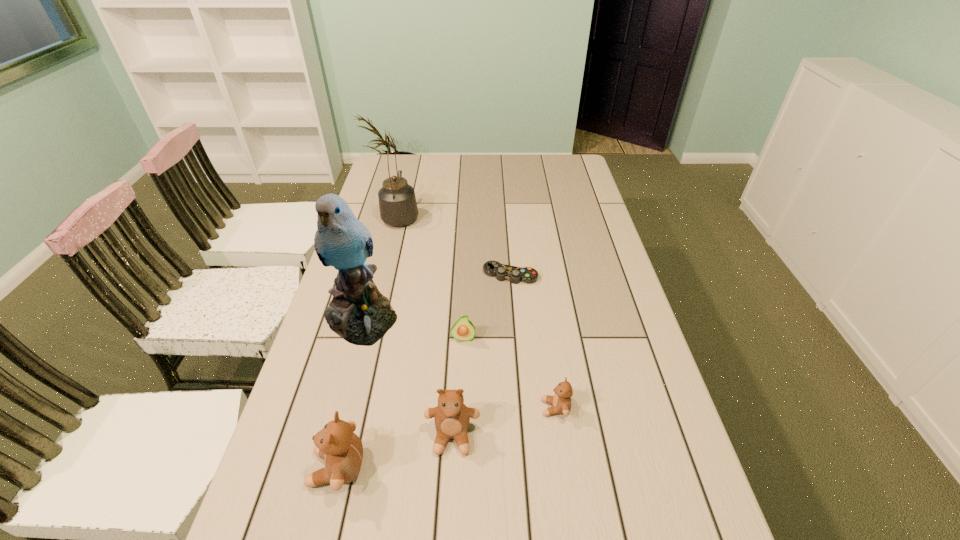
Find the location of a particular element. The image size is (960, 540). vacant space at the far left corner of the desktop is located at coordinates (395, 174).

Locate an element on the screen. This screenshot has width=960, height=540. vacant space at the near left corner of the desktop is located at coordinates (257, 504).

You are a GUI agent. You are given a task and a screenshot of the screen. Output one action in this format:
    pyautogui.click(x=<x>, y=<y>)
    Task: Click on the vacant region between the tallest object and the sixth shortest object
    This screenshot has width=960, height=540.
    Given the screenshot: What is the action you would take?
    pyautogui.click(x=381, y=266)

Find the location of `vacant area that lies between the avocado and the rightmost teddy bear`. vacant area that lies between the avocado and the rightmost teddy bear is located at coordinates (510, 373).

At what (x,y) coordinates should I click in order to perform the action: click on vacant area that lies between the rightmost teddy bear and the parakeet. Please return your answer as a coordinate pair (x, y). Image resolution: width=960 pixels, height=540 pixels. Looking at the image, I should click on (459, 362).

Find the location of `empty space that is in between the shortest object and the kettle`. empty space that is in between the shortest object and the kettle is located at coordinates (456, 245).

Where is `free space between the avocado and the kettle`? This screenshot has width=960, height=540. free space between the avocado and the kettle is located at coordinates (432, 276).

Where is `unoccupied position between the control and the tallest object`? unoccupied position between the control and the tallest object is located at coordinates (436, 296).

The height and width of the screenshot is (540, 960). I want to click on free spot between the second tallest object and the avocado, so click(x=432, y=276).

Point out which object is positioned as the fourth nearest to the control. Please provide its 2D coordinates. Your answer should be formatted as a tuple, i.e. [(x, y)], where the tuple contains the x and y coordinates of a point satisfying the conditions above.

[(561, 401)]